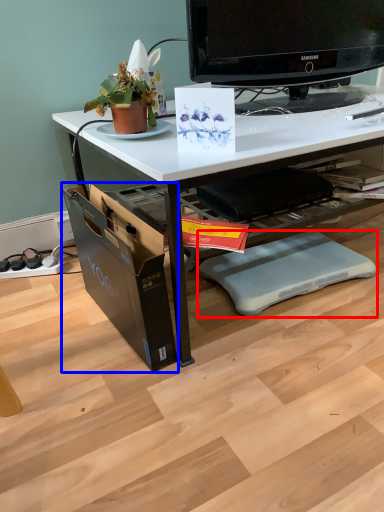
Question: Which object appears farthest to the camera in this image, swivel chair (highlighted by a red box) or file cabinet (highlighted by a blue box)?

Choices:
 (A) swivel chair
 (B) file cabinet

Answer: (A)